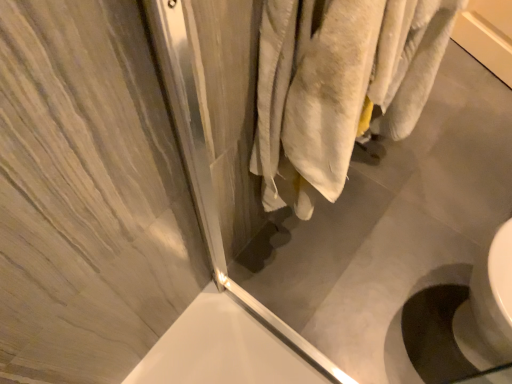
Where is `free space to the left of translucent glass screen door at upper right`? This screenshot has width=512, height=384. free space to the left of translucent glass screen door at upper right is located at coordinates pyautogui.click(x=225, y=347).